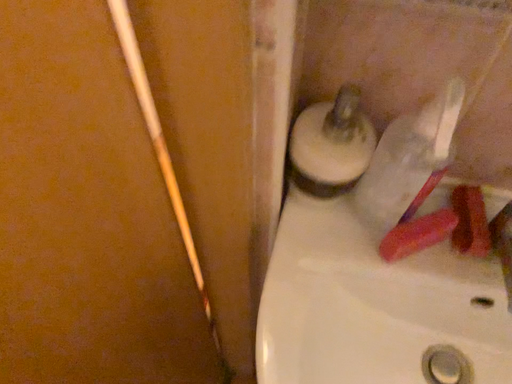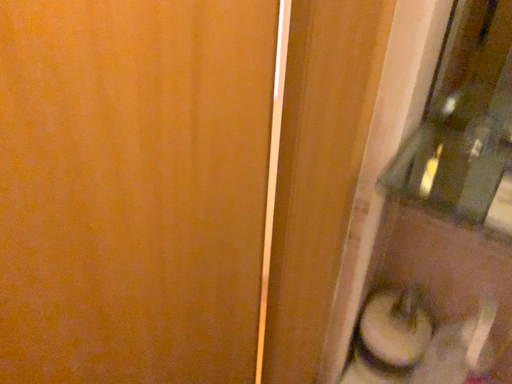
Question: How did the camera likely rotate when shooting the video?

Choices:
 (A) rotated downward
 (B) rotated upward

Answer: (B)